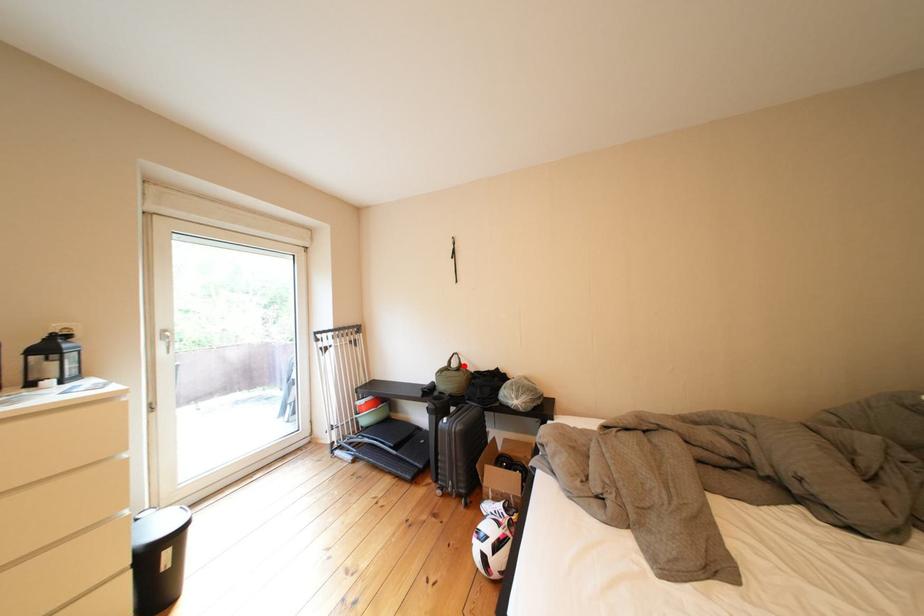
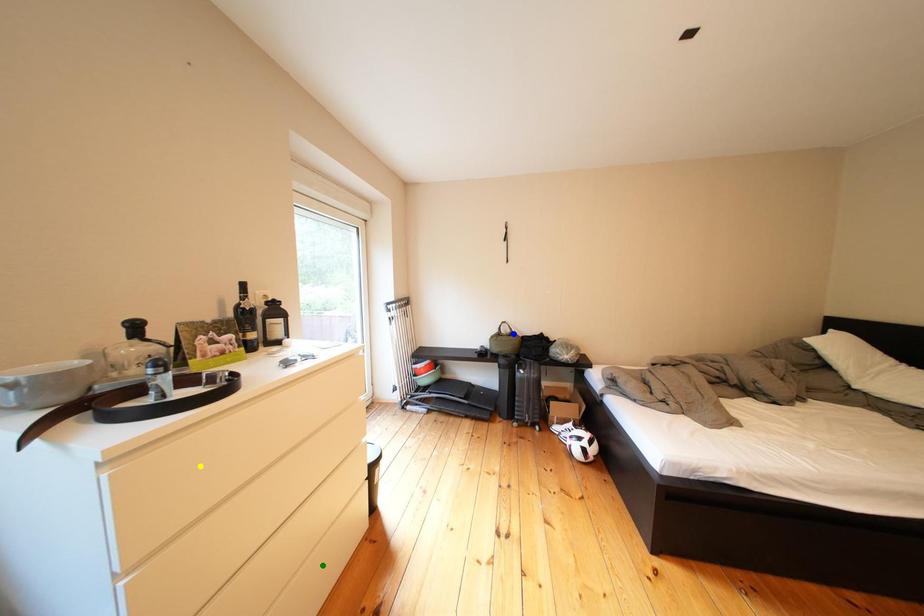
Question: I am providing you with two images of the same scene from different viewpoints. A red point is marked on the first image. You are given multiple points on the second image. Can you choose the point in image 2 that corresponds to the point in image 1?

Choices:
 (A) yellow point
 (B) blue point
 (C) green point

Answer: (B)